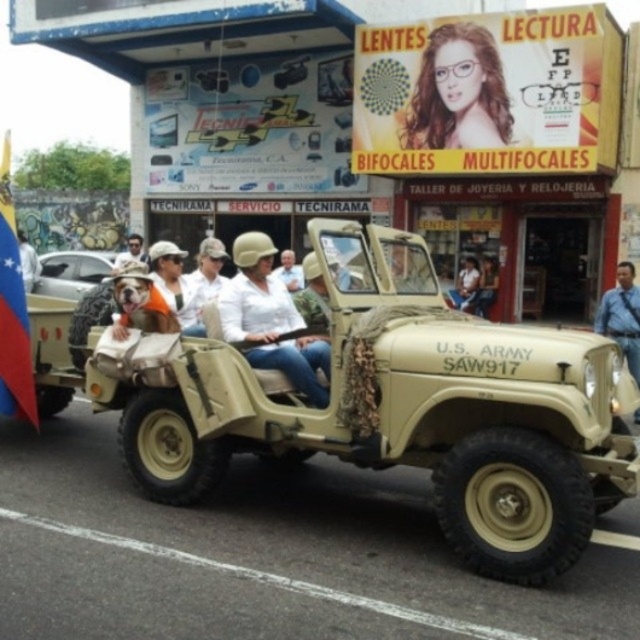
Question: Can you confirm if blue shirt at right is positioned below white fabric flag at left?

Choices:
 (A) no
 (B) yes

Answer: (B)

Question: Which object appears closest to the camera in this image?

Choices:
 (A) orange fabric dog at center
 (B) white matte shirt at center
 (C) matte white helmet at upper center
 (D) light brown leather jacket at center

Answer: (A)

Question: Can you confirm if white matte helmet at center is thinner than matte white helmet at upper center?

Choices:
 (A) no
 (B) yes

Answer: (A)

Question: Which point appears closest to the camera in this image?

Choices:
 (A) (132, 292)
 (B) (129, 250)
 (C) (72, 276)
 (D) (170, 296)

Answer: (A)

Question: Which object is farther from the camera taking this photo?

Choices:
 (A) blue shirt at right
 (B) light brown leather jacket at center
 (C) matte khaki helmet at center
 (D) white matte shirt at center

Answer: (B)

Question: Does blue shirt at right appear on the right side of matte white helmet at upper center?

Choices:
 (A) yes
 (B) no

Answer: (A)